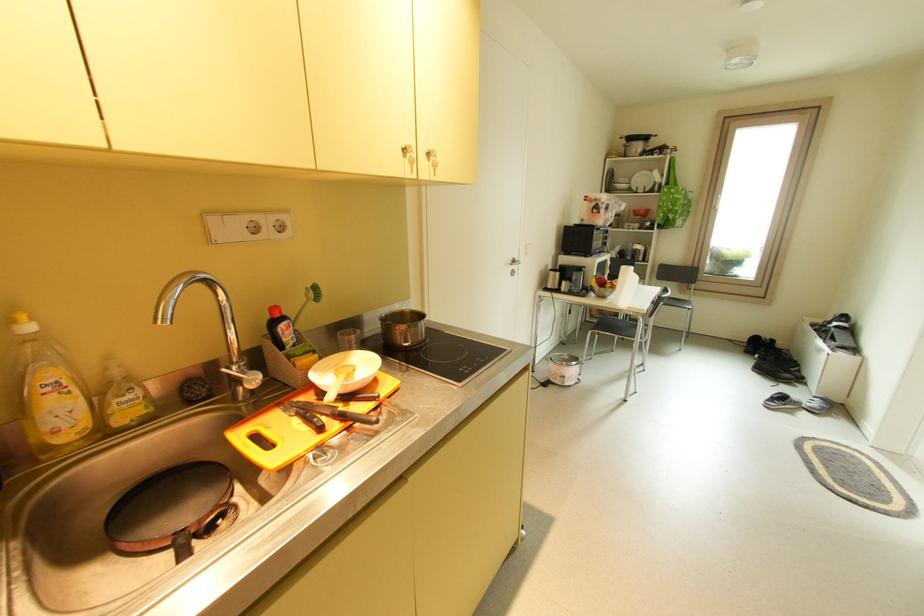
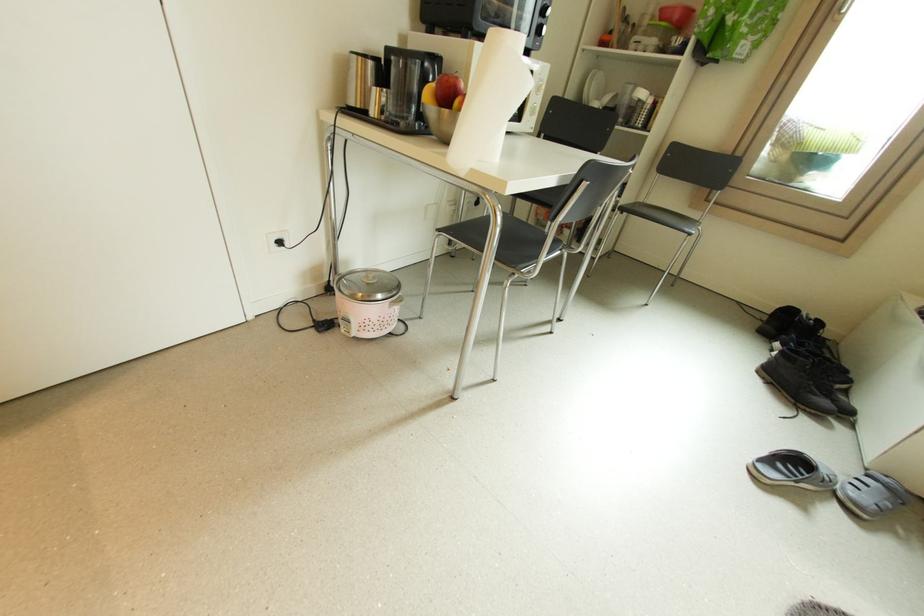
Find the pixel in the second image that matches (786,399) in the first image.

(799, 463)